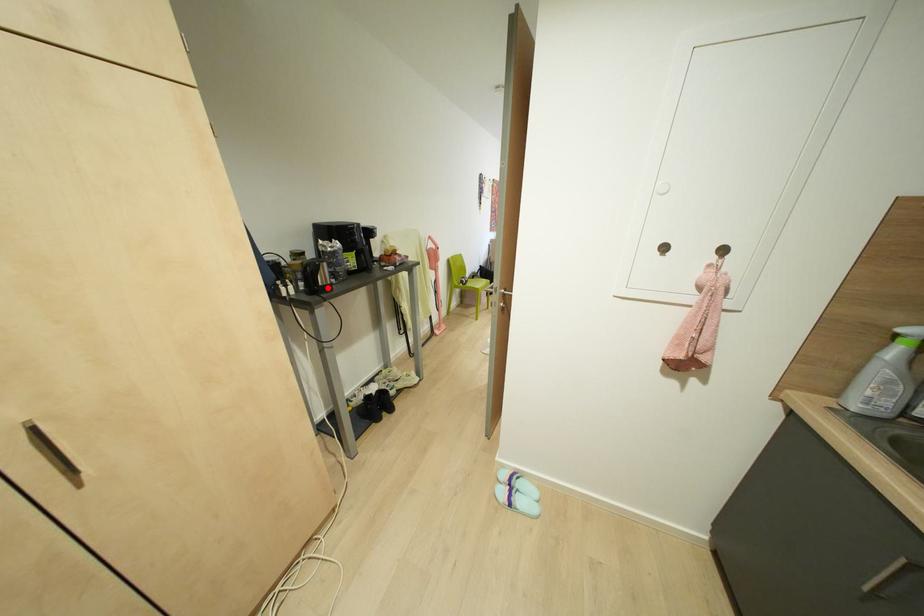
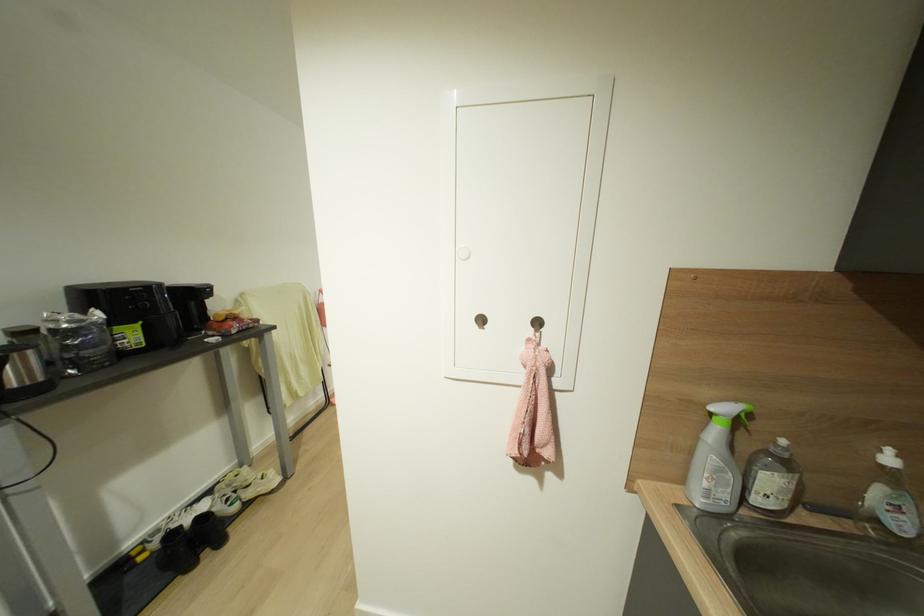
Where in the second image is the point corresponding to the highlighted location from the first image?

(39, 389)